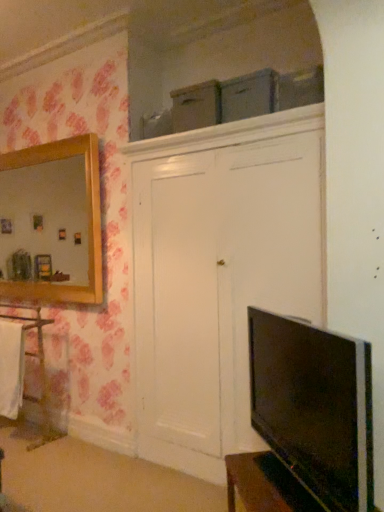
Question: Does white wood cabinet at left turn towards black glossy tv at lower right?

Choices:
 (A) no
 (B) yes

Answer: (A)

Question: Considering the relative sizes of white wood cabinet at left and black glossy tv at lower right in the image provided, is white wood cabinet at left smaller than black glossy tv at lower right?

Choices:
 (A) yes
 (B) no

Answer: (B)

Question: From the image's perspective, is white wood cabinet at left on top of black glossy tv at lower right?

Choices:
 (A) no
 (B) yes

Answer: (A)

Question: Does white wood cabinet at left appear on the right side of black glossy tv at lower right?

Choices:
 (A) yes
 (B) no

Answer: (B)

Question: From a real-world perspective, is white wood cabinet at left physically below black glossy tv at lower right?

Choices:
 (A) no
 (B) yes

Answer: (B)

Question: From the image's perspective, is white fabric towel at left above or below shiny black vanity at lower right?

Choices:
 (A) above
 (B) below

Answer: (A)

Question: Would you say white fabric towel at left is to the left or to the right of shiny black vanity at lower right in the picture?

Choices:
 (A) left
 (B) right

Answer: (A)

Question: In terms of height, does white fabric towel at left look taller or shorter compared to shiny black vanity at lower right?

Choices:
 (A) tall
 (B) short

Answer: (A)

Question: In the image, is white fabric towel at left positioned in front of or behind shiny black vanity at lower right?

Choices:
 (A) behind
 (B) front

Answer: (A)

Question: Visually, is black glossy tv at lower right positioned to the left or to the right of white fabric towel at left?

Choices:
 (A) right
 (B) left

Answer: (A)

Question: Is point (369, 431) positioned closer to the camera than point (8, 350)?

Choices:
 (A) farther
 (B) closer

Answer: (B)

Question: Is black glossy tv at lower right wider or thinner than white fabric towel at left?

Choices:
 (A) wide
 (B) thin

Answer: (A)

Question: Based on their sizes in the image, would you say black glossy tv at lower right is bigger or smaller than white fabric towel at left?

Choices:
 (A) big
 (B) small

Answer: (A)

Question: Looking at their shapes, would you say white fabric towel at left is wider or thinner than white wood cabinet at left?

Choices:
 (A) thin
 (B) wide

Answer: (A)

Question: From a real-world perspective, is white fabric towel at left above or below white wood cabinet at left?

Choices:
 (A) above
 (B) below

Answer: (A)